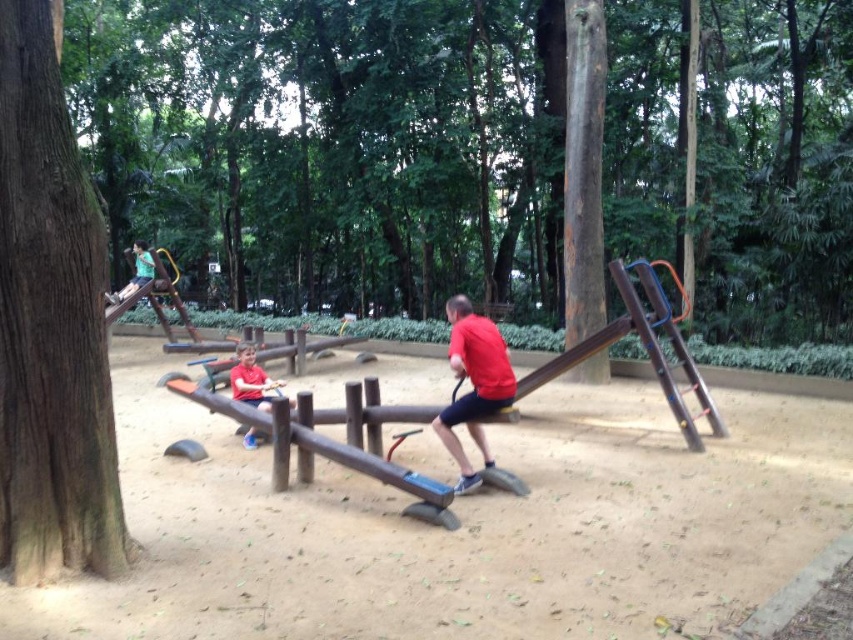
You are standing at the playground and want to hand a toy to the child wearing the red matte shirt at center. Based on the distance, is the child within your immediate reach?

The red matte shirt at center is 5.45 meters away from the viewer, which is too far for immediate reach. You need to move closer to hand the toy.

You are a parent observing the playground. You notice two children on the seesaw wearing the same color shirt. One is wearing a red matte shirt at center and the other is wearing a matte red shirt at center. Which child is wearing the wider shirt?

The red matte shirt at center is wider than the matte red shirt at center.